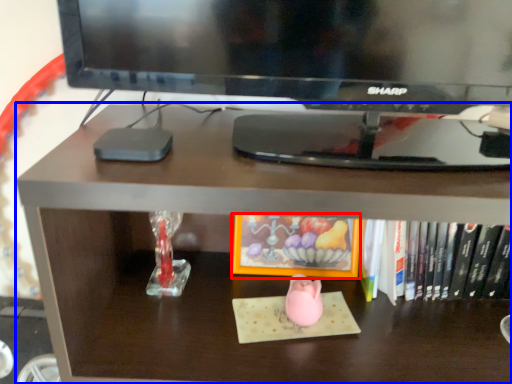
Question: Among these objects, which one is farthest to the camera, book (highlighted by a red box) or desk (highlighted by a blue box)?

Choices:
 (A) book
 (B) desk

Answer: (A)